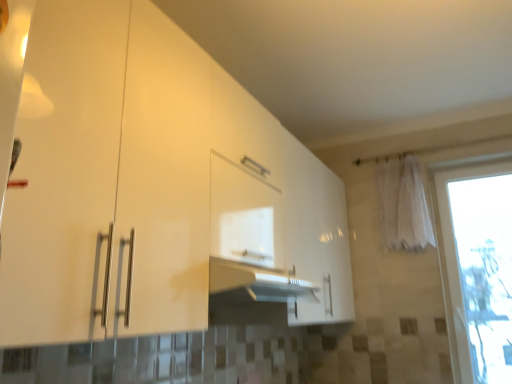
Question: Is white glossy cabinet at center bigger than transparent glass window at right?

Choices:
 (A) no
 (B) yes

Answer: (B)

Question: From the image's perspective, is white glossy cabinet at center above transparent glass window at right?

Choices:
 (A) yes
 (B) no

Answer: (A)

Question: Does white glossy cabinet at center have a smaller size compared to transparent glass window at right?

Choices:
 (A) yes
 (B) no

Answer: (B)

Question: Does white glossy cabinet at center turn towards transparent glass window at right?

Choices:
 (A) yes
 (B) no

Answer: (A)

Question: Is the position of white glossy cabinet at center less distant than that of transparent glass window at right?

Choices:
 (A) yes
 (B) no

Answer: (A)

Question: Is white glossy cabinet at center turned away from transparent glass window at right?

Choices:
 (A) yes
 (B) no

Answer: (B)

Question: Does white glossy cabinet at center have a greater height compared to white fabric curtain at upper right?

Choices:
 (A) yes
 (B) no

Answer: (A)

Question: Is white fabric curtain at upper right surrounded by white glossy cabinet at center?

Choices:
 (A) no
 (B) yes

Answer: (A)

Question: Is white glossy cabinet at center completely or partially outside of white fabric curtain at upper right?

Choices:
 (A) no
 (B) yes

Answer: (B)

Question: Does white glossy cabinet at center have a larger size compared to white fabric curtain at upper right?

Choices:
 (A) yes
 (B) no

Answer: (A)

Question: From the image's perspective, would you say white glossy cabinet at center is positioned over white fabric curtain at upper right?

Choices:
 (A) no
 (B) yes

Answer: (A)

Question: From a real-world perspective, is white glossy cabinet at center positioned over white fabric curtain at upper right based on gravity?

Choices:
 (A) yes
 (B) no

Answer: (B)

Question: Can white fabric curtain at upper right be found inside transparent glass window at right?

Choices:
 (A) yes
 (B) no

Answer: (B)